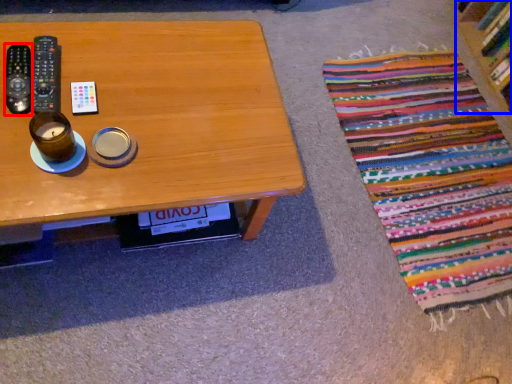
Question: Which object appears farthest to the camera in this image, remote control (highlighted by a red box) or shelf (highlighted by a blue box)?

Choices:
 (A) remote control
 (B) shelf

Answer: (B)